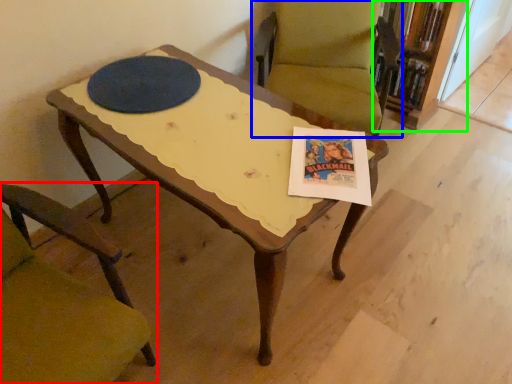
Question: Which is nearer to the chair (highlighted by a red box)? chair (highlighted by a blue box) or bookcase (highlighted by a green box).

Choices:
 (A) chair
 (B) bookcase

Answer: (A)